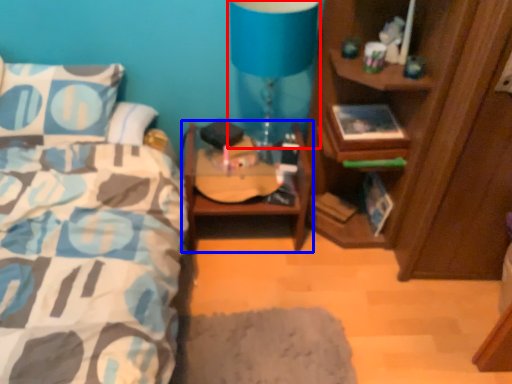
Question: Among these objects, which one is nearest to the camera, table lamp (highlighted by a red box) or nightstand (highlighted by a blue box)?

Choices:
 (A) table lamp
 (B) nightstand

Answer: (A)